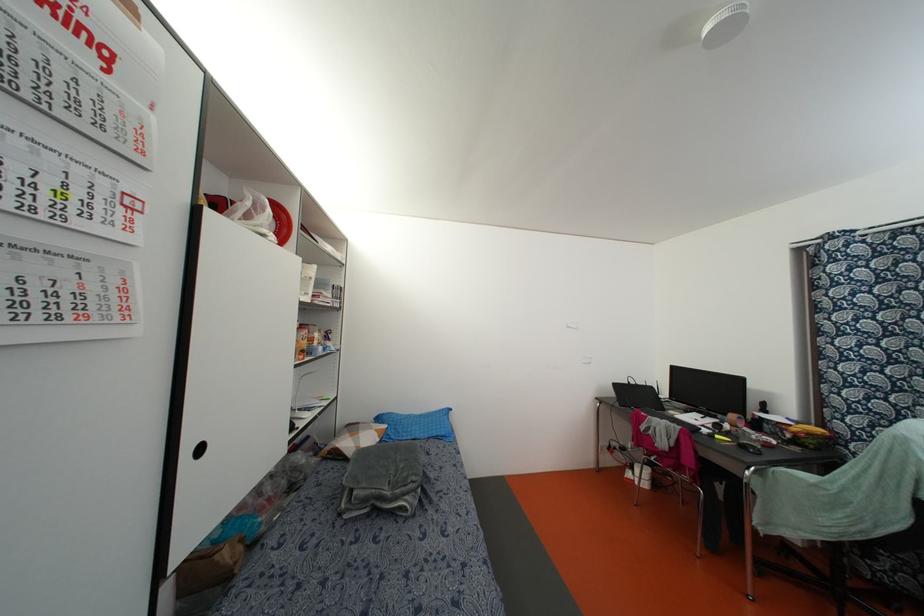
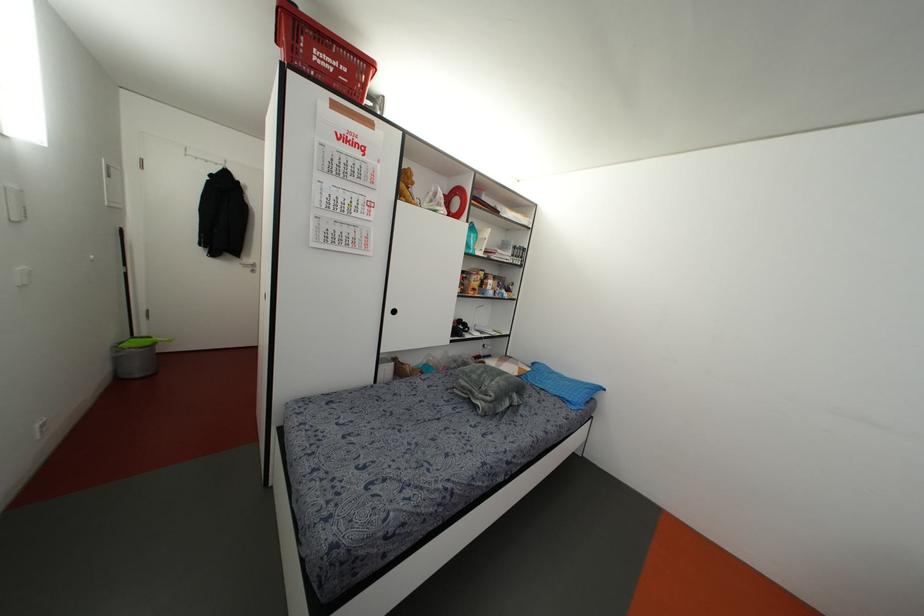
Question: The camera is either moving clockwise (left) or counter-clockwise (right) around the object. The first image is from the beginning of the video and the second image is from the end. Is the camera moving left or right when shooting the video?

Choices:
 (A) Left
 (B) Right

Answer: (B)